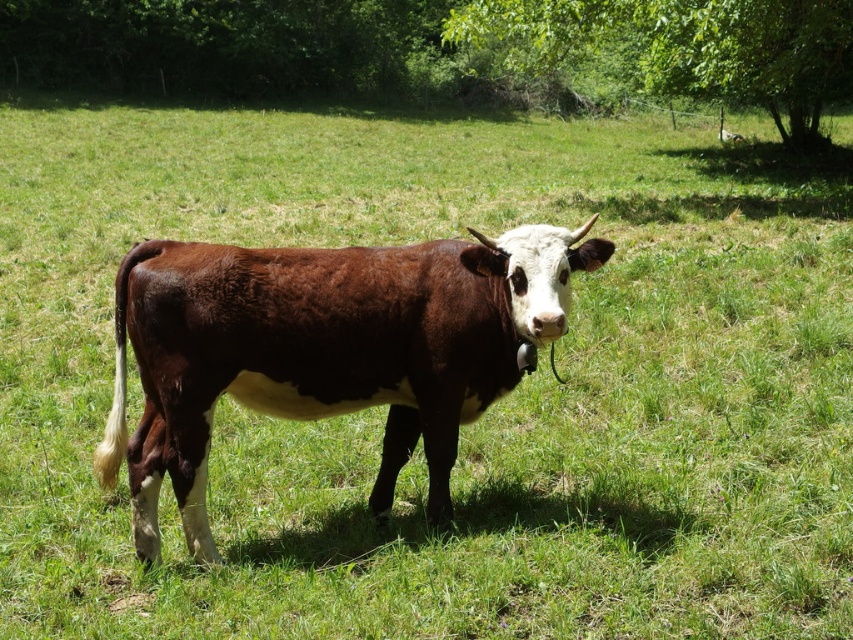
Is brown smooth cow at center shorter than green leafy tree at upper right?

Yes.

This screenshot has width=853, height=640. Describe the element at coordinates (326, 349) in the screenshot. I see `brown smooth cow at center` at that location.

The width and height of the screenshot is (853, 640). I want to click on brown smooth cow at center, so click(326, 349).